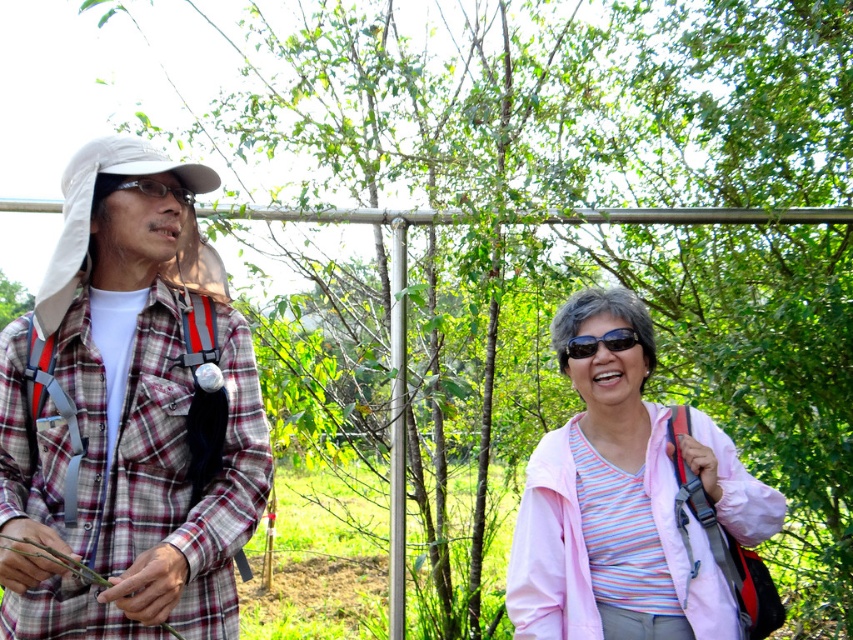
Can you confirm if plaid fabric shirt at left is thinner than pink fabric jacket at lower right?

Yes.

Who is higher up, plaid fabric shirt at left or pink fabric jacket at lower right?

plaid fabric shirt at left is higher up.

Find the location of a particular element. The image size is (853, 640). plaid fabric shirt at left is located at coordinates (125, 419).

At what (x,y) coordinates should I click in order to perform the action: click on plaid fabric shirt at left. Please return your answer as a coordinate pair (x, y). Looking at the image, I should click on (125, 419).

How much distance is there between plaid fabric shirt at left and matte black glasses at left?

22.89 inches

Who is more distant from viewer, (218, 364) or (161, 196)?

The point (218, 364) is more distant.

At what (x,y) coordinates should I click in order to perform the action: click on plaid fabric shirt at left. Please return your answer as a coordinate pair (x, y). The width and height of the screenshot is (853, 640). Looking at the image, I should click on (125, 419).

Which is above, plaid fabric shirt at left or black plastic sunglasses at center?

black plastic sunglasses at center is higher up.

Is point (177, 180) positioned after point (606, 340)?

No, it is not.

Identify the location of plaid fabric shirt at left. Image resolution: width=853 pixels, height=640 pixels. (125, 419).